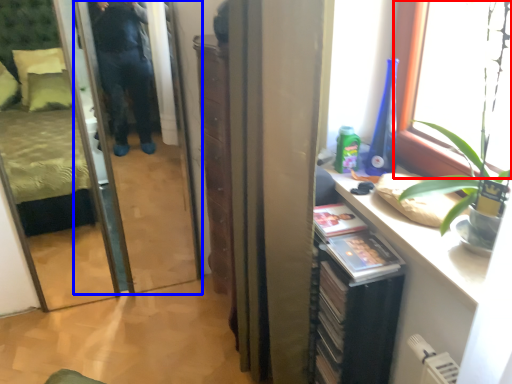
Question: Among these objects, which one is nearest to the camera, window (highlighted by a red box) or screen door (highlighted by a blue box)?

Choices:
 (A) window
 (B) screen door

Answer: (A)